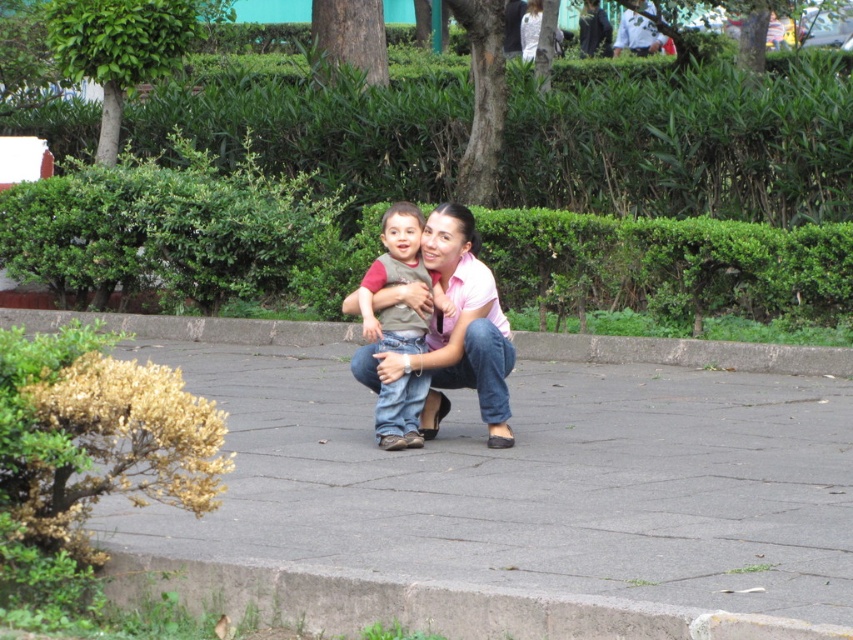
Question: Among these points, which one is nearest to the camera?

Choices:
 (A) (599, 340)
 (B) (383, 236)
 (C) (177, 554)

Answer: (C)

Question: Can you confirm if concrete at center is positioned above matte brown vest at center?

Choices:
 (A) yes
 (B) no

Answer: (A)

Question: Considering the relative positions of concrete at center and matte brown vest at center in the image provided, where is concrete at center located with respect to matte brown vest at center?

Choices:
 (A) below
 (B) above

Answer: (B)

Question: Observing the image, what is the correct spatial positioning of concrete at center in reference to matte brown vest at center?

Choices:
 (A) right
 (B) left

Answer: (B)

Question: Estimate the real-world distances between objects in this image. Which object is farther from the matte brown vest at center?

Choices:
 (A) concrete at center
 (B) gray concrete pavement at center

Answer: (A)

Question: Which of the following is the closest to the observer?

Choices:
 (A) (267, 595)
 (B) (604, 362)

Answer: (A)